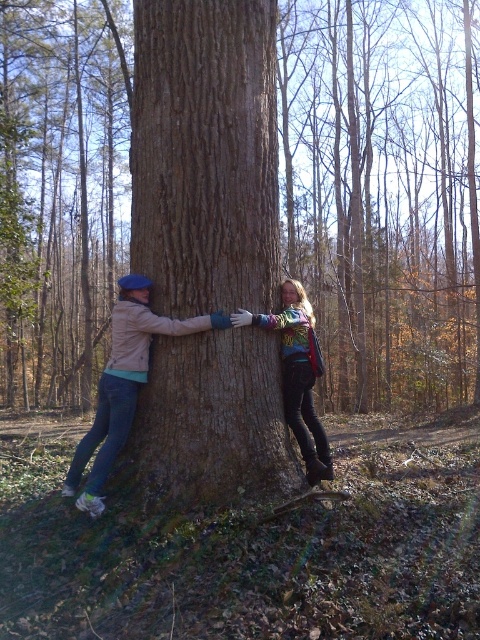
You are standing in a forest and want to locate the brown rough textured tree trunk at center. According to the coordinates provided, where would you find it?

The brown rough textured tree trunk at center is located at point 0.303 on the x axis and 0.800 on the y axis.

You are standing in front of the large tree trunk and notice two points marked on it. Which of the two points, point (172, 378) or point (123, 371), is closer to you?

Point (172, 378) is closer to you because it is further to the viewer than point (123, 371).